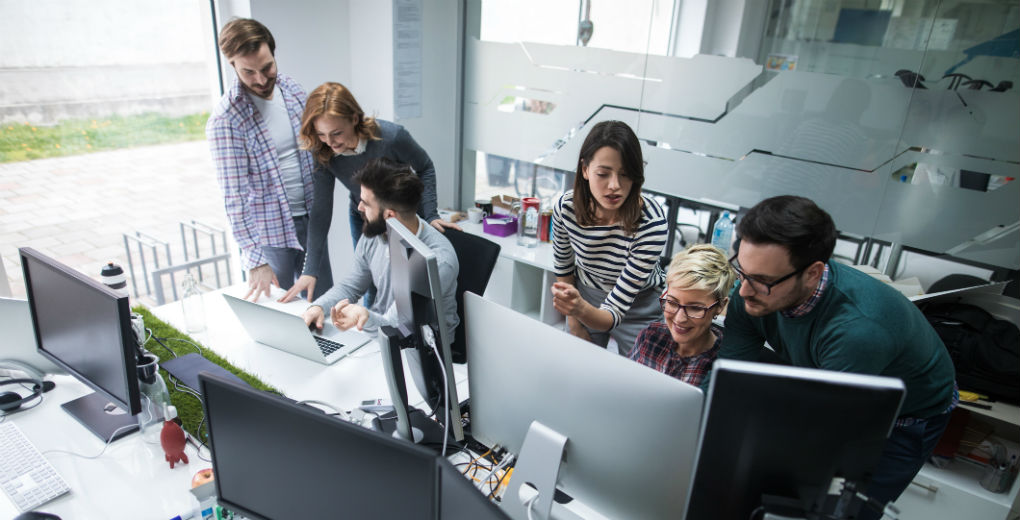
You are a GUI agent. You are given a task and a screenshot of the screen. Output one action in this format:
    pyautogui.click(x=<x>, y=<y>)
    Task: Click on the screens
    This screenshot has height=520, width=1020.
    Given the screenshot: What is the action you would take?
    pyautogui.click(x=93, y=331), pyautogui.click(x=269, y=435), pyautogui.click(x=549, y=386), pyautogui.click(x=280, y=317), pyautogui.click(x=797, y=394)